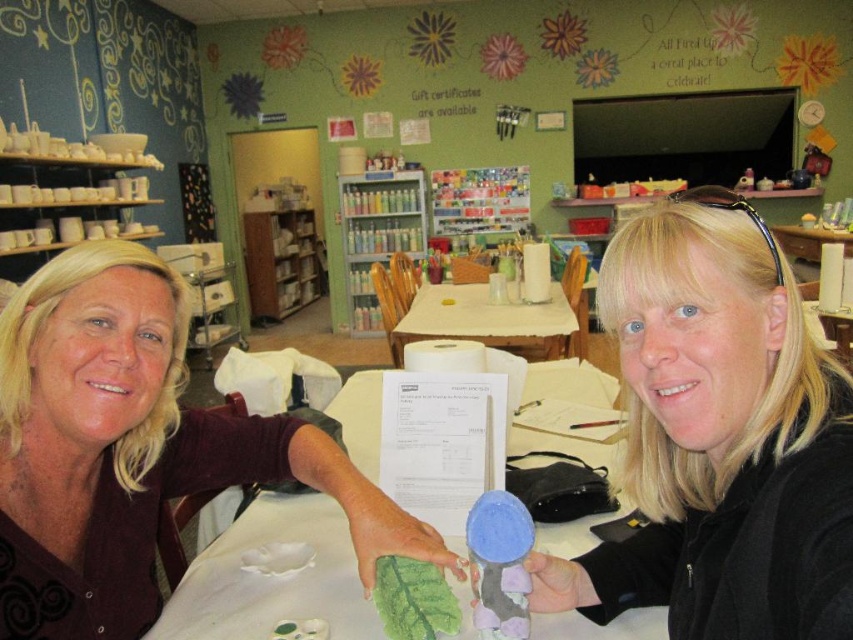
You are a customer in a pottery studio and want to place both the matte green clay leaf at center and the matte blue plush toy at center on a shelf. The shelf has a height limit of 15 cm. Can both items fit vertically on the shelf without exceeding the height limit?

The matte green clay leaf at center is taller than the matte blue plush toy at center. Since the shelf has a height limit of 15 cm, we need to know the exact height of the taller item. However, the description only states that the matte green clay leaf at center is taller than the matte blue plush toy at center. Without specific measurements, we cannot confirm if both items will fit within the 15 cm limit.

You are trying to place the matte green clay leaf at center onto the wooden bookshelf at center. Considering their sizes, will the leaf fit on the shelf without overlapping the edges?

The matte green clay leaf at center has a larger width than the wooden bookshelf at center, so it will not fit without overlapping the edges.